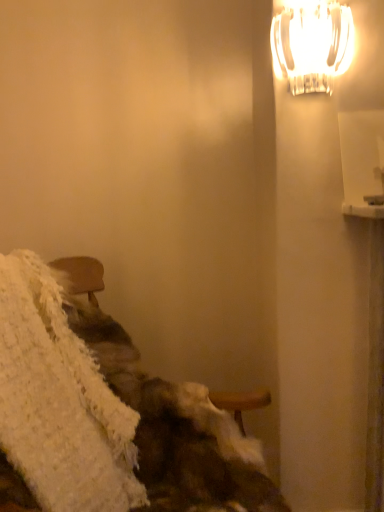
This screenshot has height=512, width=384. What do you see at coordinates (59, 401) in the screenshot?
I see `white fluffy blanket at lower left` at bounding box center [59, 401].

Locate an element on the screen. white fluffy blanket at lower left is located at coordinates (59, 401).

Measure the distance between point (97, 480) and camera.

They are 1.04 meters apart.

What do you see at coordinates (312, 45) in the screenshot?
I see `white frosted glass lamp at upper right` at bounding box center [312, 45].

Consider the image. In order to face white frosted glass lamp at upper right, should I rotate leftwards or rightwards?

Turn right by 15.987 degrees to look at white frosted glass lamp at upper right.

Image resolution: width=384 pixels, height=512 pixels. I want to click on white frosted glass lamp at upper right, so click(x=312, y=45).

Locate an element on the screen. Image resolution: width=384 pixels, height=512 pixels. white fluffy blanket at lower left is located at coordinates (59, 401).

Considering the positions of objects white fluffy blanket at lower left and white frosted glass lamp at upper right in the image provided, who is more to the left, white fluffy blanket at lower left or white frosted glass lamp at upper right?

Positioned to the left is white fluffy blanket at lower left.

Who is more distant, white fluffy blanket at lower left or white frosted glass lamp at upper right?

white frosted glass lamp at upper right is behind.

Does point (19, 458) come farther from viewer compared to point (303, 49)?

No, it is not.

From the image's perspective, is white fluffy blanket at lower left located above or below white frosted glass lamp at upper right?

Based on their image positions, white fluffy blanket at lower left is located beneath white frosted glass lamp at upper right.

From a real-world perspective, which object stands above the other?

white frosted glass lamp at upper right, from a real-world perspective.

Between white fluffy blanket at lower left and white frosted glass lamp at upper right, which one has larger width?

white fluffy blanket at lower left is wider.

From their relative heights in the image, would you say white fluffy blanket at lower left is taller or shorter than white frosted glass lamp at upper right?

white fluffy blanket at lower left is taller than white frosted glass lamp at upper right.

Is white fluffy blanket at lower left smaller than white frosted glass lamp at upper right?

No.

Is white fluffy blanket at lower left located outside white frosted glass lamp at upper right?

Yes, white fluffy blanket at lower left is not within white frosted glass lamp at upper right.

Based on the photo, are white fluffy blanket at lower left and white frosted glass lamp at upper right far apart?

No, white fluffy blanket at lower left is not far from white frosted glass lamp at upper right.

Could you tell me if white fluffy blanket at lower left is facing white frosted glass lamp at upper right?

No, white fluffy blanket at lower left is not turned towards white frosted glass lamp at upper right.

At what (x,y) coordinates should I click in order to perform the action: click on blanket in front of the white frosted glass lamp at upper right. Please return your answer as a coordinate pair (x, y). The image size is (384, 512). Looking at the image, I should click on (59, 401).

Based on their positions, is white frosted glass lamp at upper right located to the left or right of white fluffy blanket at lower left?

Answer: Based on their positions, white frosted glass lamp at upper right is located to the right of white fluffy blanket at lower left.

Does white frosted glass lamp at upper right come in front of white fluffy blanket at lower left?

No, the depth of white frosted glass lamp at upper right is greater than that of white fluffy blanket at lower left.

Is point (344, 36) positioned behind point (15, 350)?

Yes.

From the image's perspective, is white frosted glass lamp at upper right located above white fluffy blanket at lower left?

Yes, from the image's perspective, white frosted glass lamp at upper right is over white fluffy blanket at lower left.

From a real-world perspective, which is physically above, white frosted glass lamp at upper right or white fluffy blanket at lower left?

From a 3D spatial view, white frosted glass lamp at upper right is above.

Can you confirm if white frosted glass lamp at upper right is wider than white fluffy blanket at lower left?

No, white frosted glass lamp at upper right is not wider than white fluffy blanket at lower left.

Is white frosted glass lamp at upper right taller or shorter than white fluffy blanket at lower left?

In the image, white frosted glass lamp at upper right appears to be shorter than white fluffy blanket at lower left.

Which of these two, white frosted glass lamp at upper right or white fluffy blanket at lower left, is smaller?

white frosted glass lamp at upper right is smaller.

Is white fluffy blanket at lower left completely or partially inside white frosted glass lamp at upper right?

No, white fluffy blanket at lower left is not inside white frosted glass lamp at upper right.

Is white frosted glass lamp at upper right placed right next to white fluffy blanket at lower left?

No, white frosted glass lamp at upper right is not touching white fluffy blanket at lower left.

Could you tell me if white frosted glass lamp at upper right is facing white fluffy blanket at lower left?

No, white frosted glass lamp at upper right is not aimed at white fluffy blanket at lower left.

How many degrees apart are the facing directions of white frosted glass lamp at upper right and white fluffy blanket at lower left?

63.2 degrees.

In the scene shown: Measure the distance between white frosted glass lamp at upper right and white fluffy blanket at lower left.

38.34 inches.

This screenshot has width=384, height=512. In order to click on lamp above the white fluffy blanket at lower left (from a real-world perspective) in this screenshot , I will do `click(312, 45)`.

At what (x,y) coordinates should I click in order to perform the action: click on blanket beneath the white frosted glass lamp at upper right (from a real-world perspective). Please return your answer as a coordinate pair (x, y). Image resolution: width=384 pixels, height=512 pixels. Looking at the image, I should click on (59, 401).

Identify the location of blanket lying in front of the white frosted glass lamp at upper right. (59, 401).